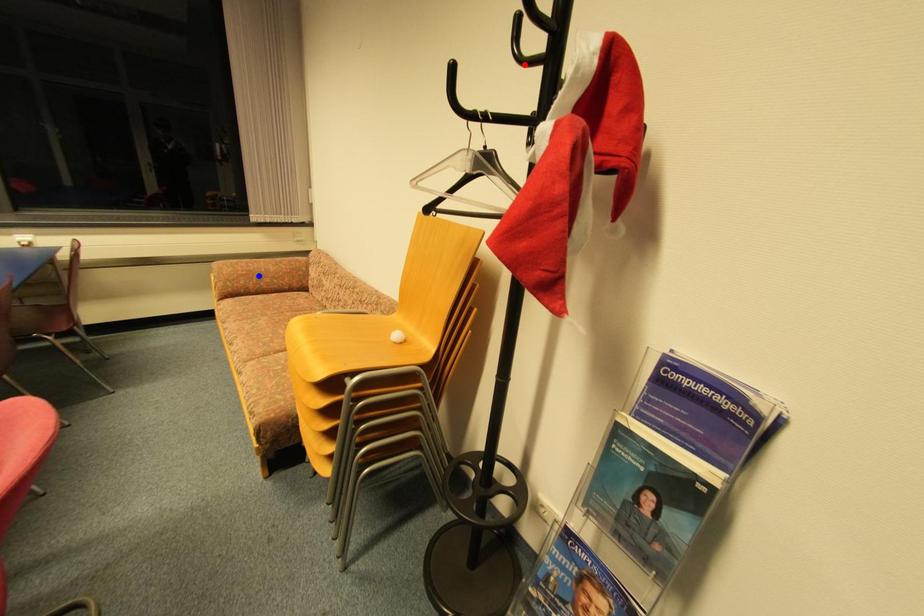
Question: Which of the two points in the image is closer to the camera?

Choices:
 (A) Blue point is closer.
 (B) Red point is closer.

Answer: (B)